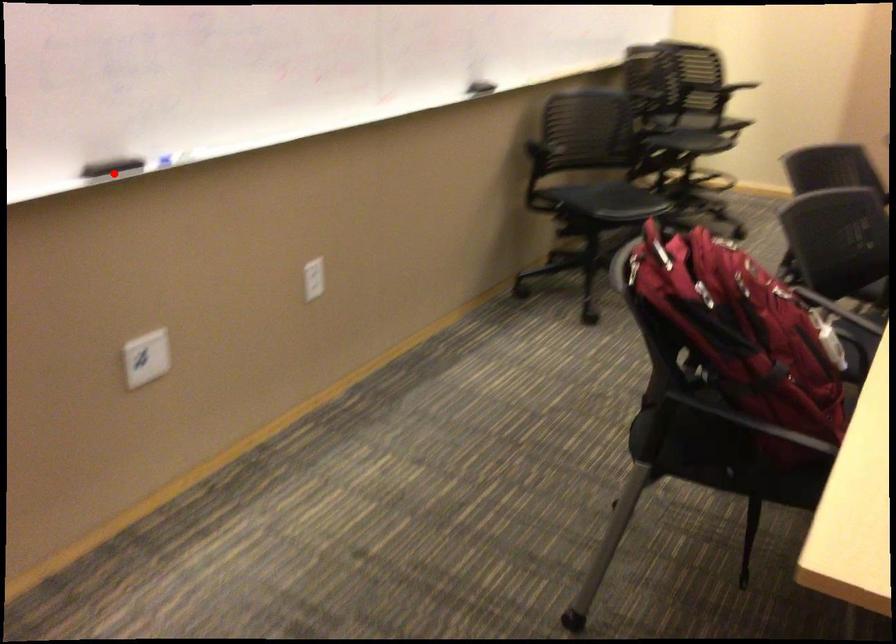
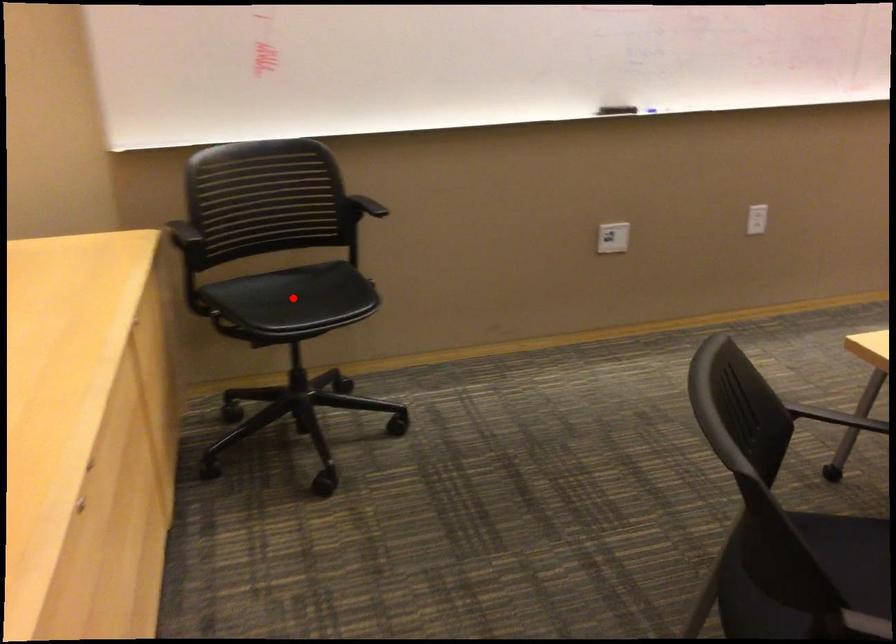
I am providing you with two images of the same scene from different viewpoints. A red point is marked on the first image and another point is marked on the second image. Do the highlighted points in image1 and image2 indicate the same real-world spot?

No